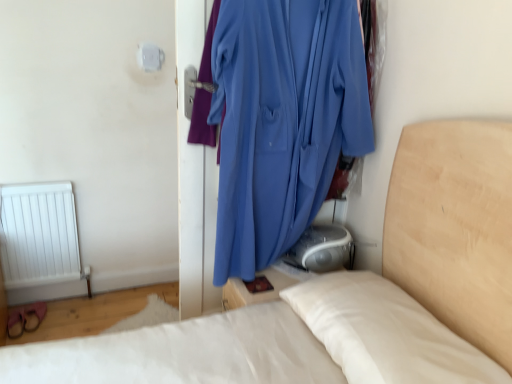
Question: From the image's perspective, is smooth white bed at center above or below blue fabric at center?

Choices:
 (A) above
 (B) below

Answer: (B)

Question: Would you say smooth white bed at center is inside or outside blue fabric at center?

Choices:
 (A) outside
 (B) inside

Answer: (A)

Question: From a real-world perspective, is smooth white bed at center physically located above or below blue fabric at center?

Choices:
 (A) below
 (B) above

Answer: (A)

Question: In terms of size, does blue fabric at center appear bigger or smaller than smooth white bed at center?

Choices:
 (A) big
 (B) small

Answer: (B)

Question: From the image's perspective, is blue fabric at center above or below smooth white bed at center?

Choices:
 (A) above
 (B) below

Answer: (A)

Question: In the image, is blue fabric at center positioned in front of or behind smooth white bed at center?

Choices:
 (A) behind
 (B) front

Answer: (A)

Question: From their relative heights in the image, would you say blue fabric at center is taller or shorter than smooth white bed at center?

Choices:
 (A) short
 (B) tall

Answer: (B)